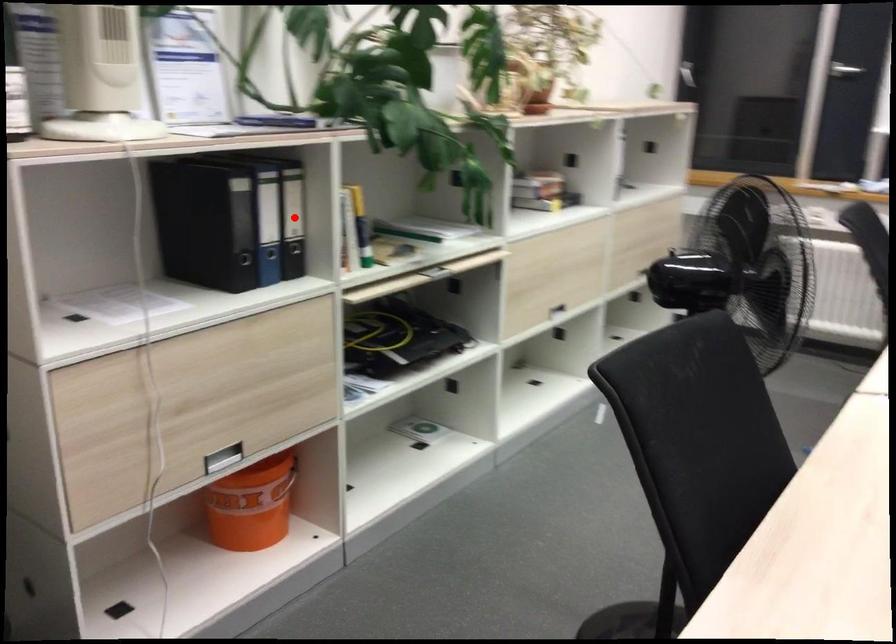
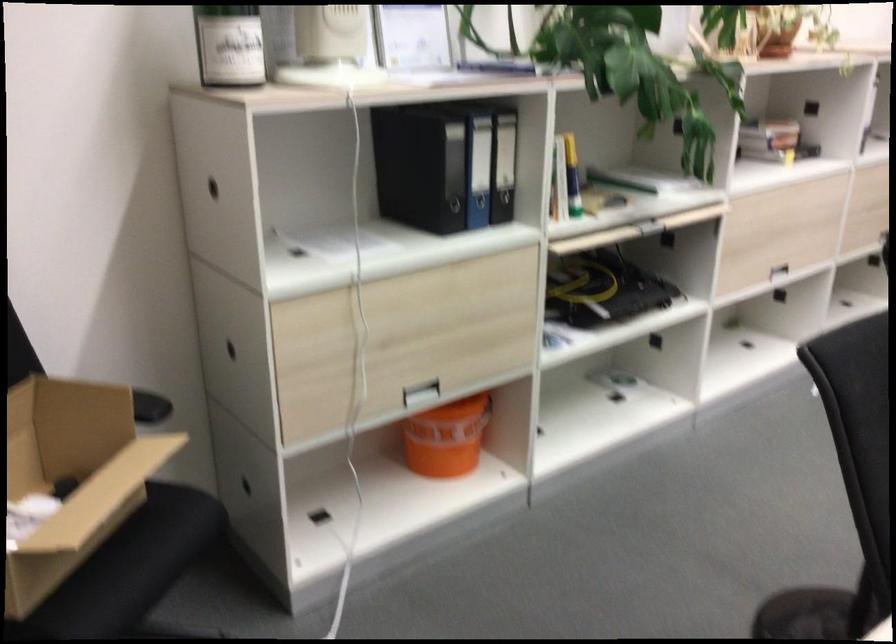
The point at the highlighted location is marked in the first image. Where is the corresponding point in the second image?

(504, 165)